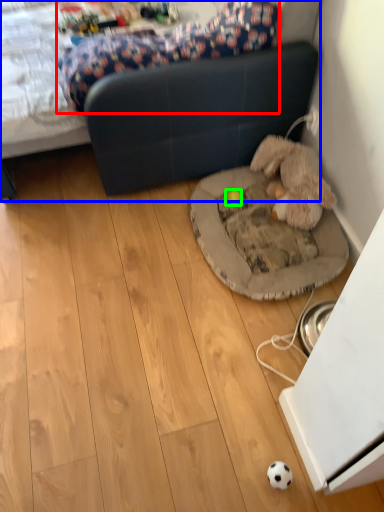
Question: Which object is positioned farthest from mattress (highlighted by a red box)? Select from studio couch (highlighted by a blue box) and toy (highlighted by a green box).

Choices:
 (A) studio couch
 (B) toy

Answer: (B)